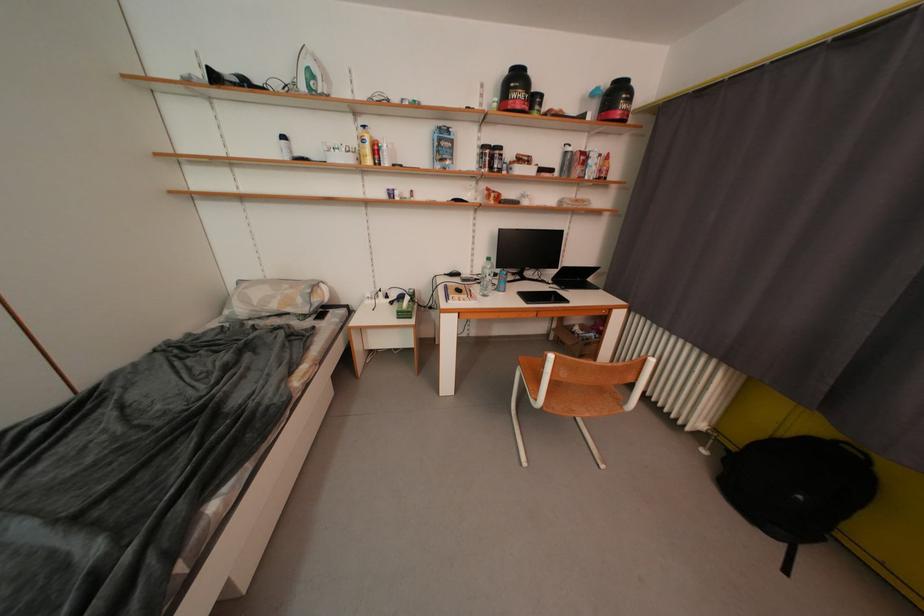
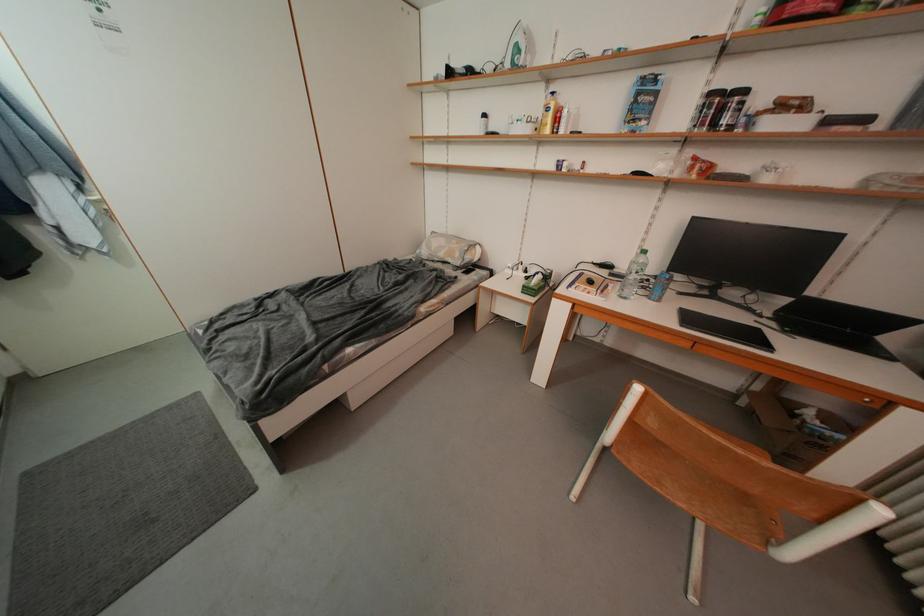
Question: How did the camera likely rotate?

Choices:
 (A) Left
 (B) Right
 (C) Up
 (D) Down

Answer: (A)